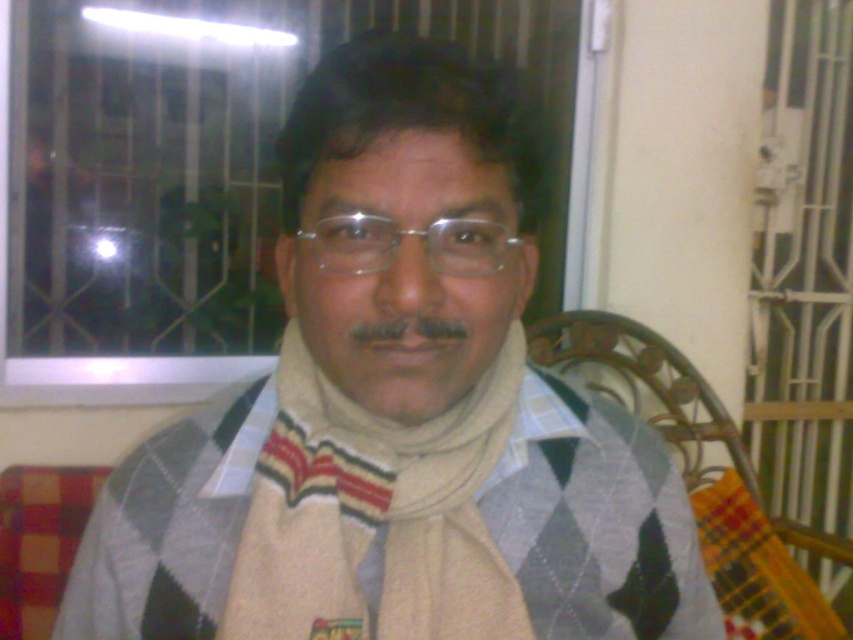
Question: Does beige knitted scarf at center have a larger size compared to clear plastic glasses at center?

Choices:
 (A) yes
 (B) no

Answer: (A)

Question: Is beige knitted scarf at center positioned at the back of clear plastic glasses at center?

Choices:
 (A) no
 (B) yes

Answer: (B)

Question: Among these points, which one is farthest from the camera?

Choices:
 (A) (363, 212)
 (B) (457, 504)

Answer: (B)

Question: Is beige knitted scarf at center wider than clear plastic glasses at center?

Choices:
 (A) yes
 (B) no

Answer: (A)